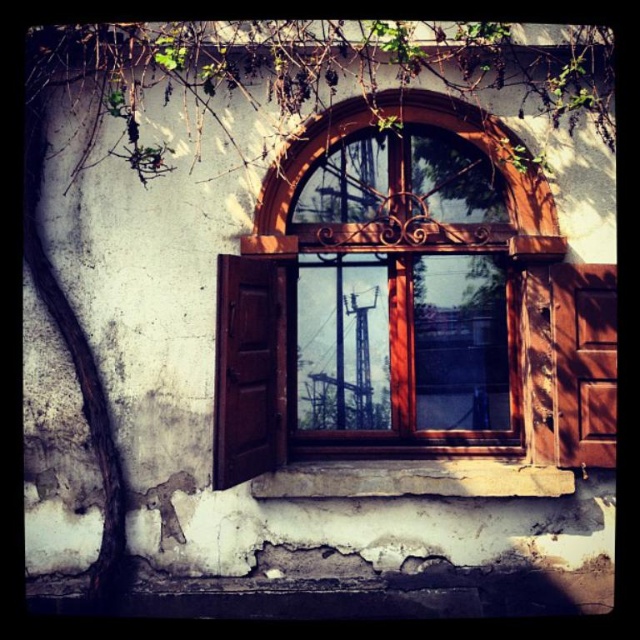
Does point (358, 138) come closer to viewer compared to point (502, 465)?

No, it is not.

Can you confirm if wooden window at center is positioned above wooden at lower center?

Correct, wooden window at center is located above wooden at lower center.

This screenshot has width=640, height=640. Find the location of `wooden window at center`. wooden window at center is located at coordinates (390, 314).

Looking at this image, measure the distance from green leafy vine at upper center to wooden at lower center.

They are 6.86 feet apart.

Between point (531, 76) and point (564, 492), which one is positioned behind?

Point (531, 76)

What do you see at coordinates (323, 65) in the screenshot? I see `green leafy vine at upper center` at bounding box center [323, 65].

Where is `green leafy vine at upper center`? green leafy vine at upper center is located at coordinates (323, 65).

Can you confirm if wooden window at center is bigger than green leafy vine at upper center?

Indeed, wooden window at center has a larger size compared to green leafy vine at upper center.

Is wooden window at center further to the viewer compared to green leafy vine at upper center?

That is True.

Who is more distant from viewer, (458, 289) or (593, 60)?

Positioned behind is point (458, 289).

Where is `wooden window at center`? The width and height of the screenshot is (640, 640). wooden window at center is located at coordinates (390, 314).